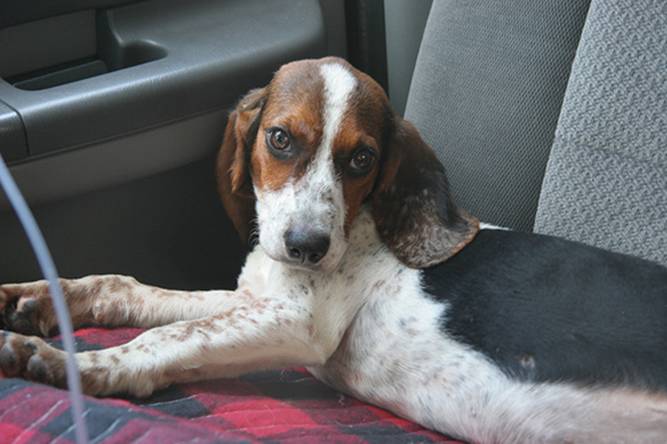
Where is `red and black blanket`? red and black blanket is located at coordinates (261, 395), (191, 407), (15, 414), (167, 420), (339, 427).